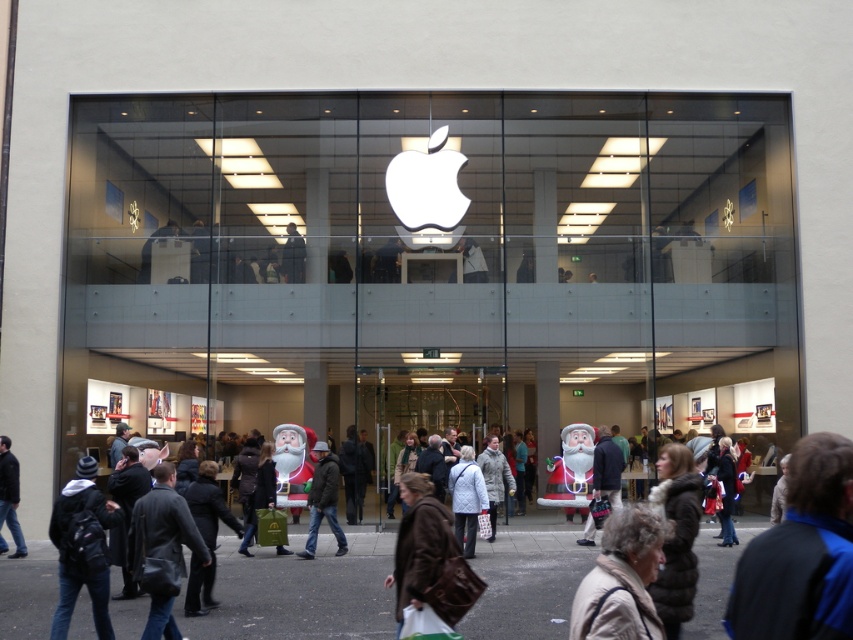
Does light brown leather jacket at lower right come behind dark blue jeans at lower left?

No, light brown leather jacket at lower right is in front of dark blue jeans at lower left.

Which of these two, light brown leather jacket at lower right or dark blue jeans at lower left, stands taller?

Standing taller between the two is dark blue jeans at lower left.

Is point (625, 621) positioned behind point (76, 465)?

That is False.

Locate an element on the screen. The width and height of the screenshot is (853, 640). light brown leather jacket at lower right is located at coordinates (622, 579).

Does brown leather jacket at lower right appear on the left side of light brown leather jacket at lower right?

Incorrect, brown leather jacket at lower right is not on the left side of light brown leather jacket at lower right.

Which of these two, brown leather jacket at lower right or light brown leather jacket at lower right, stands shorter?

Standing shorter between the two is light brown leather jacket at lower right.

Is point (801, 515) positioned before point (583, 616)?

Yes, it is in front of point (583, 616).

Where is `brown leather jacket at lower right`? The height and width of the screenshot is (640, 853). brown leather jacket at lower right is located at coordinates (801, 554).

Which is in front, point (585, 586) or point (4, 465)?

Positioned in front is point (585, 586).

Can you confirm if light brown leather jacket at lower right is smaller than dark gray jacket at lower left?

Correct, light brown leather jacket at lower right occupies less space than dark gray jacket at lower left.

Does point (589, 634) come farther from viewer compared to point (15, 529)?

No, (589, 634) is in front of (15, 529).

Where is `light brown leather jacket at lower right`? This screenshot has width=853, height=640. light brown leather jacket at lower right is located at coordinates (622, 579).